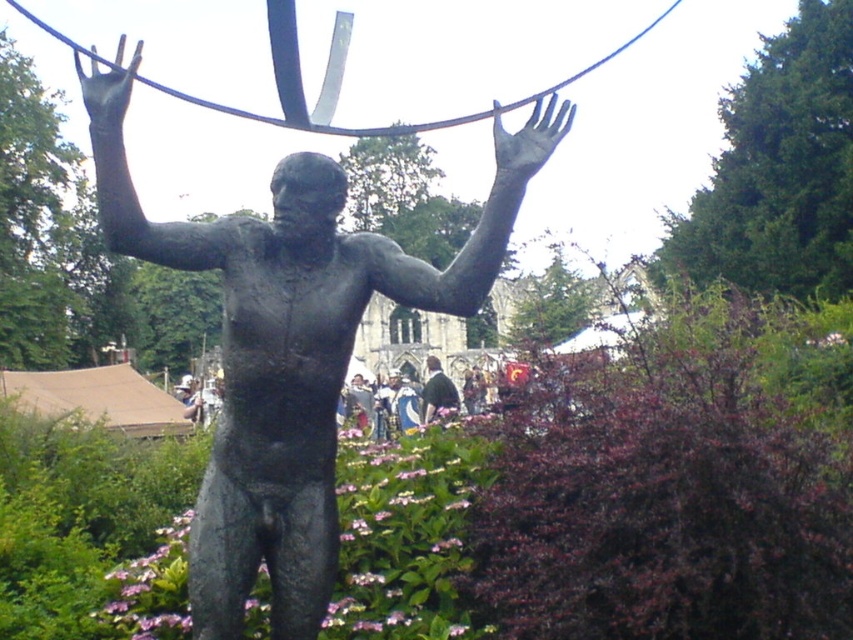
You are a photographer positioned at the center of the image. You want to capture a closeup shot of the bronze metallic hand at upper center. According to the coordinates provided, what is the exact 2D location you should aim your camera at?

The bronze metallic hand at upper center is located at the 2D coordinates point (529, 140), so you should aim your camera at that exact point to capture the closeup.

You are an art conservator examining the bronze statue and notice a specific point on the statue. Where exactly is the bronze hand at upper center located in terms of coordinates?

The bronze hand at upper center is located at coordinates point (107, 88).